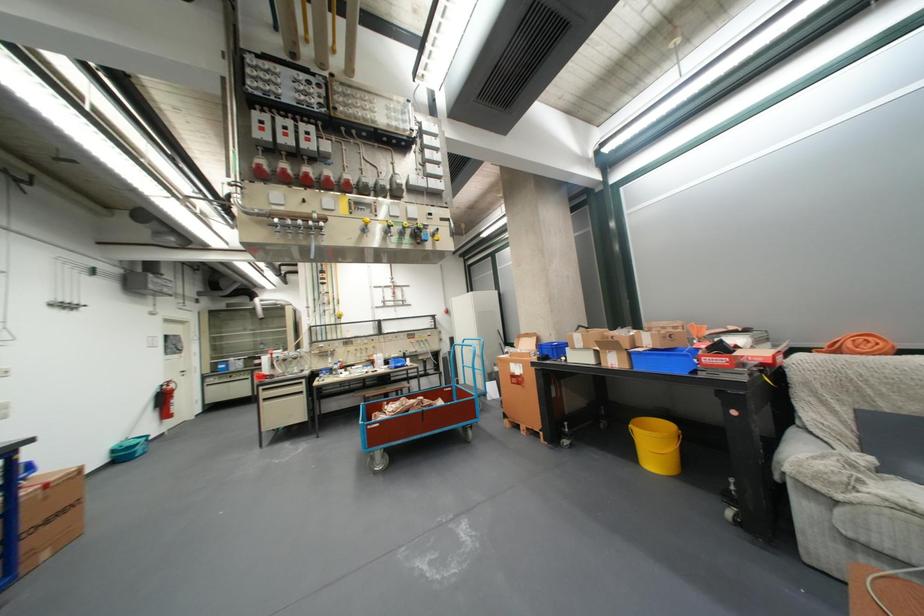
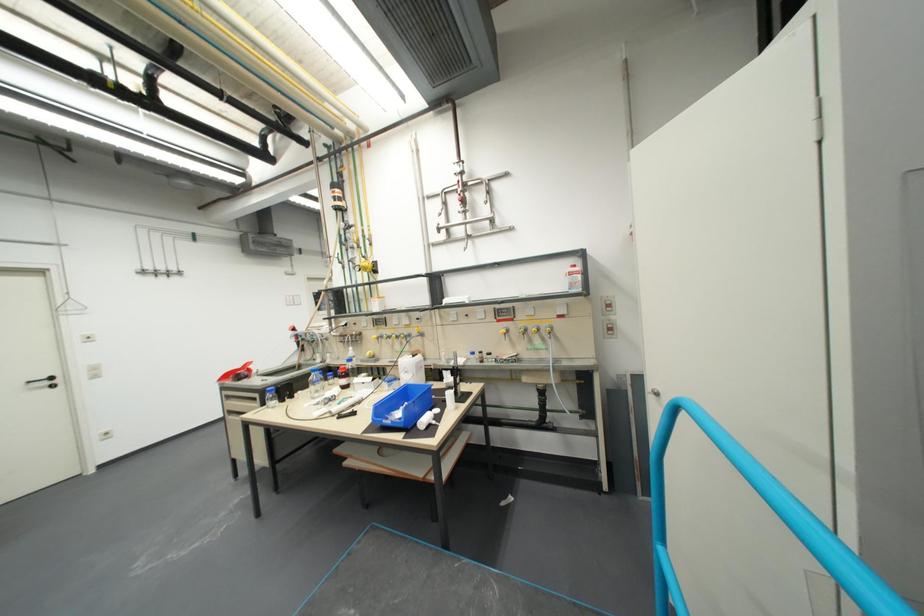
The point at (x=341, y=321) is marked in the first image. Where is the corresponding point in the second image?

(373, 278)